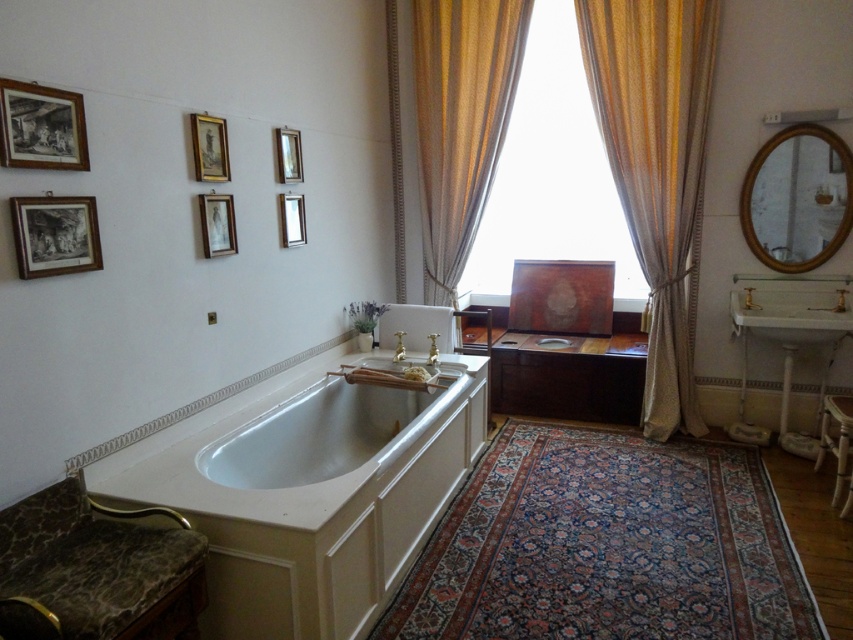
Consider the image. Does gold textured curtain at center have a smaller size compared to matte silver picture frame at upper center?

Incorrect, gold textured curtain at center is not smaller in size than matte silver picture frame at upper center.

Is point (665, 132) closer to camera compared to point (229, 228)?

That is False.

Is point (703, 128) closer to viewer compared to point (204, 252)?

No, it is behind (204, 252).

Identify the location of gold textured curtain at center. This screenshot has height=640, width=853. (654, 164).

In the scene shown: Is silky beige curtains at center shorter than gold textured curtain at center?

Indeed, silky beige curtains at center has a lesser height compared to gold textured curtain at center.

Measure the distance from silky beige curtains at center to gold textured curtain at center.

silky beige curtains at center and gold textured curtain at center are 0.88 inches apart from each other.

Is point (424, 93) positioned after point (660, 150)?

Yes, point (424, 93) is farther from viewer.

Locate an element on the screen. silky beige curtains at center is located at coordinates (654, 163).

Does point (614, 140) come behind point (223, 211)?

Yes, it is.

Which is behind, point (467, 6) or point (235, 243)?

The point (467, 6) is more distant.

Where is `silky beige curtains at center`? silky beige curtains at center is located at coordinates (654, 163).